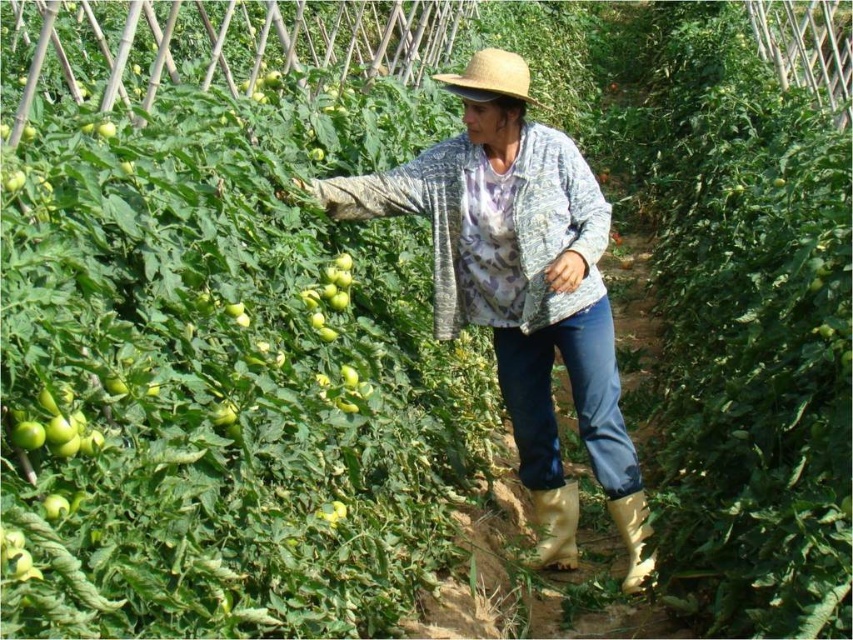
You are a worker in the greenhouse and need to choose a pair of boots to wear. You notice two yellow rubber boots in the image. Which boot has a wider base, the yellow rubber boot at lower center or the yellow rubber boot at lower right?

The yellow rubber boot at lower center has a wider base than the yellow rubber boot at lower right according to the description.